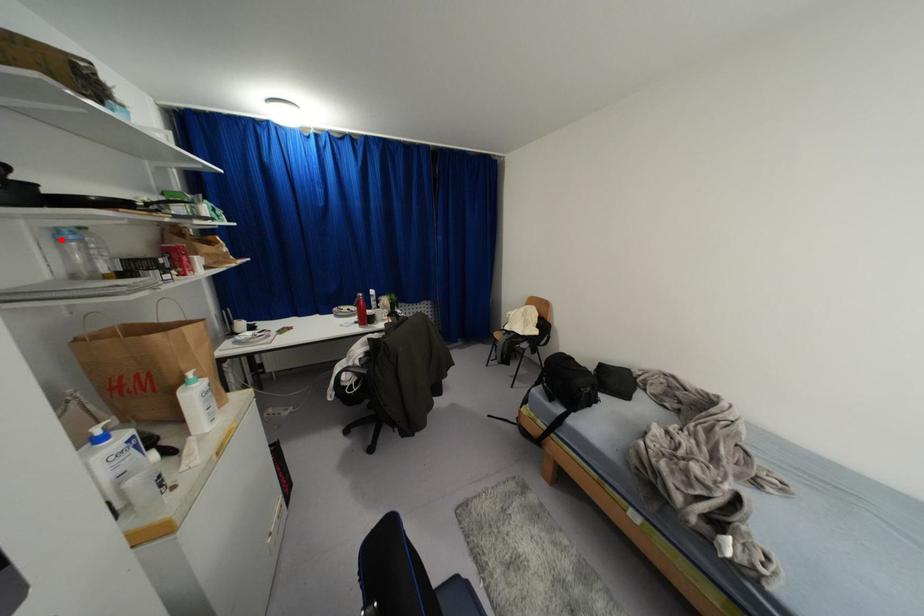
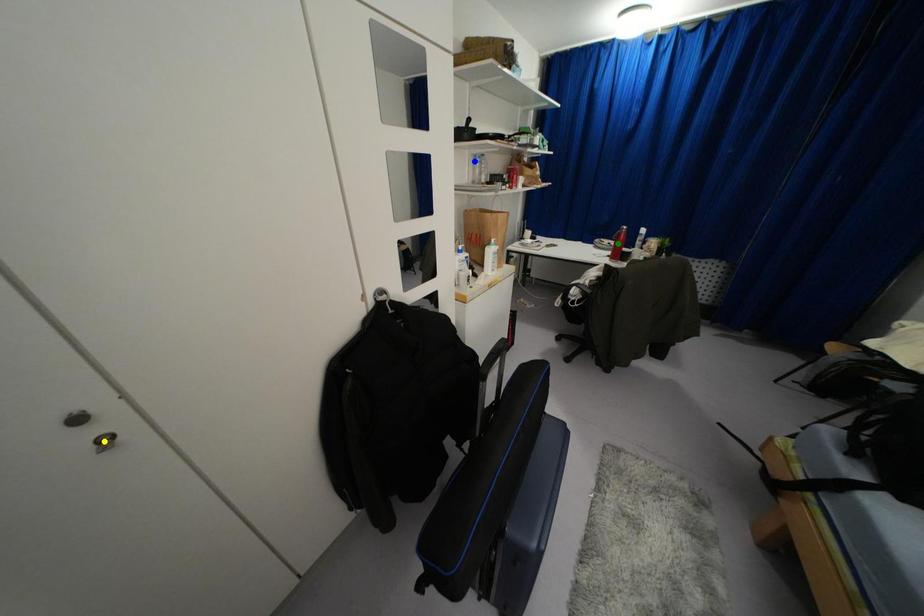
Question: I am providing you with two images of the same scene from different viewpoints. A red point is marked on the first image. You are given multiple points on the second image. Which point in image 2 represents the same 3d spot as the red point in image 1?

Choices:
 (A) green point
 (B) yellow point
 (C) blue point

Answer: (C)